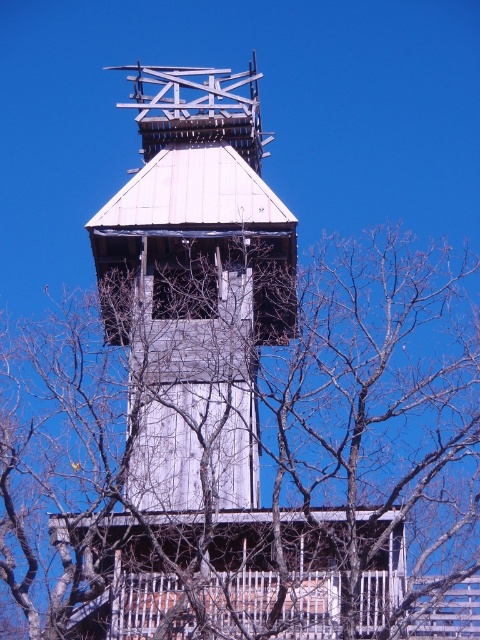
You are an arborist assessing the safety of the white wooden tower at center. You notice the bare branches at center nearby. From the perspective of someone standing in front of the tower, which side of the tower are the branches located?

The bare branches at center are positioned on the right side of the white wooden tower at center, so from the front view, the branches are on the tower s right side.

You are a bird trying to land on the white wooden tower at center. From your perspective, are the bare branches at center blocking your path to the tower?

The bare branches at center are below the white wooden tower at center, so they are not blocking the path to the tower from above.

You are standing in front of the tower and notice a specific point marked on the image. What object is located at the coordinates point (x=248, y=451)?

The point (x=248, y=451) marks bare branches at center.